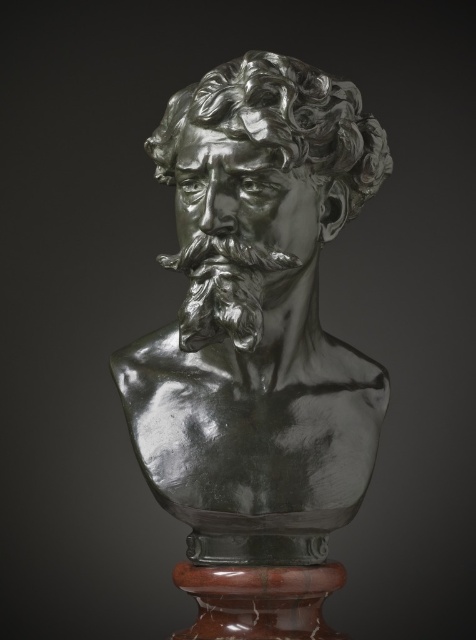
This screenshot has width=476, height=640. Describe the element at coordinates (257, 316) in the screenshot. I see `shiny bronze bust at center` at that location.

Who is more forward, (316,257) or (379,129)?

Point (379,129)

You are a GUI agent. You are given a task and a screenshot of the screen. Output one action in this format:
    pyautogui.click(x=<x>, y=<y>)
    Task: Click on the shiny bronze bust at center
    This screenshot has width=476, height=640.
    Given the screenshot: What is the action you would take?
    pyautogui.click(x=257, y=316)

Does shiny bronze bust at center have a greater width compared to shiny silver beard at center?

Correct, the width of shiny bronze bust at center exceeds that of shiny silver beard at center.

How much distance is there between shiny bronze bust at center and shiny silver beard at center?

shiny bronze bust at center and shiny silver beard at center are 3.87 inches apart.

Locate an element on the screen. Image resolution: width=476 pixels, height=640 pixels. shiny bronze bust at center is located at coordinates (257, 316).

From the picture: Can you confirm if shiny silver bust at center is bigger than shiny silver beard at center?

Yes, shiny silver bust at center is bigger than shiny silver beard at center.

Can you confirm if shiny silver bust at center is positioned above shiny silver beard at center?

Indeed, shiny silver bust at center is positioned over shiny silver beard at center.

From the picture: Who is more distant from viewer, (335, 92) or (174, 268)?

Point (174, 268)

Identify the location of shiny silver bust at center. Image resolution: width=476 pixels, height=640 pixels. (280, 122).